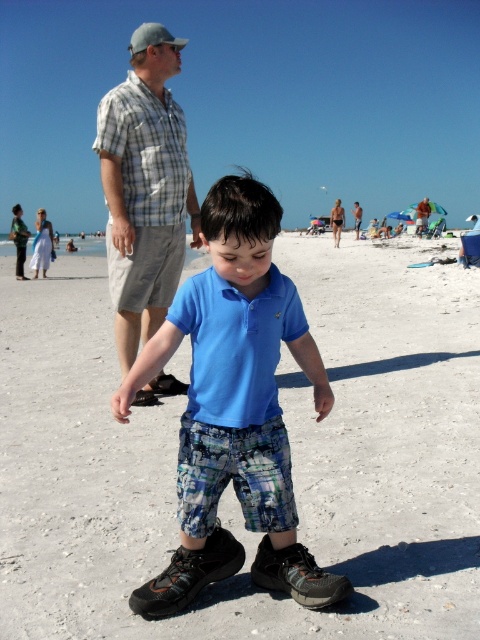
Between point (144, 54) and point (207, 493), which one is positioned behind?

Point (144, 54)

Measure the distance between plaid shirt at center and printed cotton shorts at center.

plaid shirt at center and printed cotton shorts at center are 10.71 feet apart from each other.

Does point (118, 147) lie in front of point (224, 460)?

No, (118, 147) is behind (224, 460).

At what (x,y) coordinates should I click in order to perform the action: click on plaid shirt at center. Please return your answer as a coordinate pair (x, y). This screenshot has width=480, height=640. Looking at the image, I should click on (144, 195).

Can you confirm if plaid cotton shirt at upper left is bigger than gray fabric baseball cap at upper left?

Incorrect, plaid cotton shirt at upper left is not larger than gray fabric baseball cap at upper left.

Is plaid cotton shirt at upper left smaller than gray fabric baseball cap at upper left?

Correct, plaid cotton shirt at upper left occupies less space than gray fabric baseball cap at upper left.

Locate an element on the screen. The image size is (480, 640). plaid cotton shirt at upper left is located at coordinates (145, 150).

Which is above, white sand at center or beige plaid shirt at center?

Positioned higher is beige plaid shirt at center.

Which of these two, white sand at center or beige plaid shirt at center, stands taller?

Standing taller between the two is white sand at center.

Is point (46, 396) positioned after point (417, 225)?

No.

What are the coordinates of `white sand at center` in the screenshot? It's located at (229, 484).